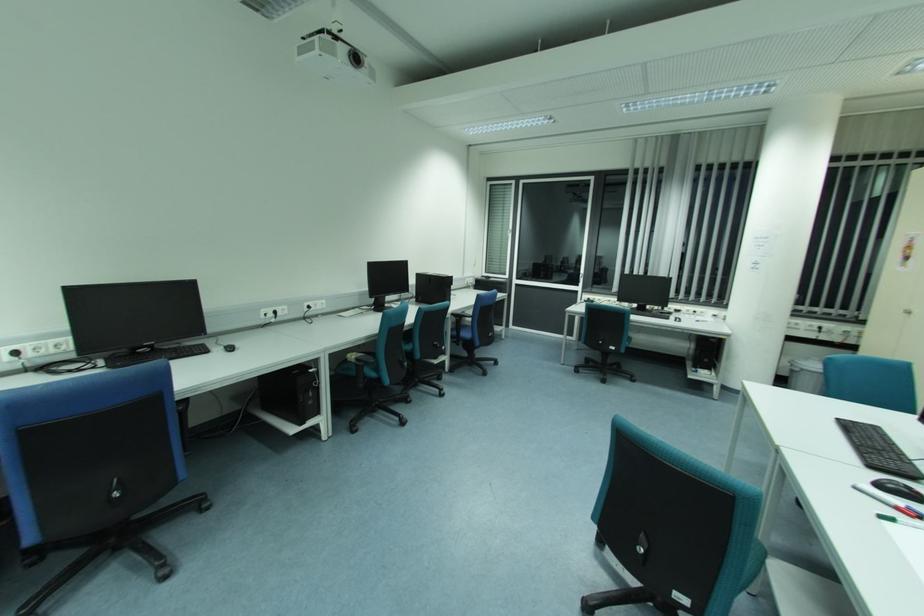
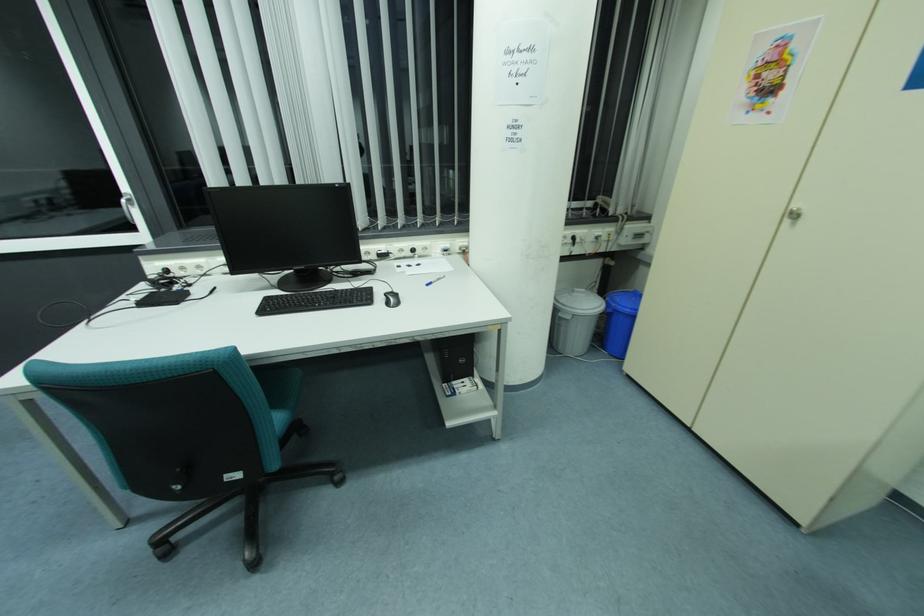
Locate, in the second image, the point that corresponds to (581,276) in the first image.

(125, 201)